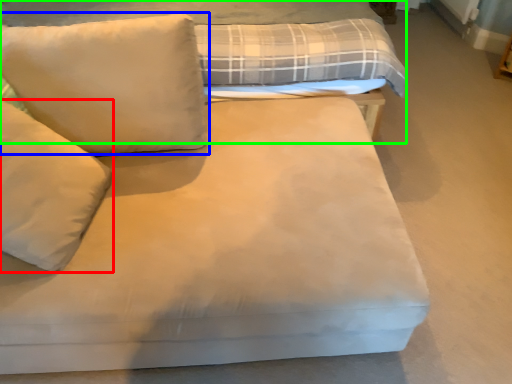
Question: Which object is the closest to the pillow (highlighted by a red box)? Choose among these: pillow (highlighted by a blue box) or bed (highlighted by a green box).

Choices:
 (A) pillow
 (B) bed

Answer: (A)